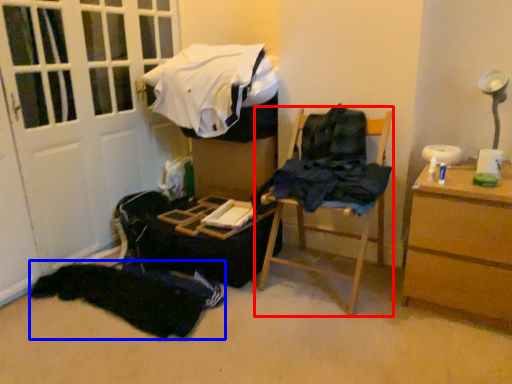
Question: Which object appears closest to the camera in this image, furniture (highlighted by a red box) or clothing (highlighted by a blue box)?

Choices:
 (A) furniture
 (B) clothing

Answer: (A)